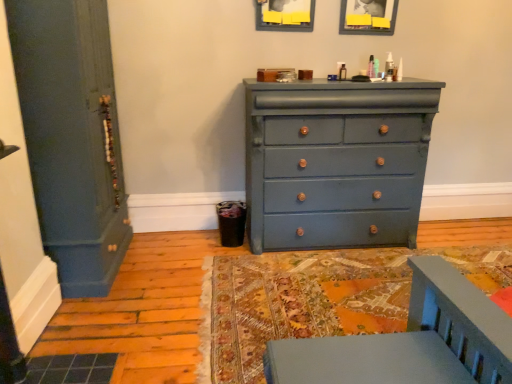
Question: Is matte wooden picture frame at upper center, positioned as the second picture frame in left-to-right order, taller than matte blue door at left?

Choices:
 (A) no
 (B) yes

Answer: (A)

Question: From a real-world perspective, is matte wooden picture frame at upper center, positioned as the 1th picture frame in right-to-left order, beneath matte blue door at left?

Choices:
 (A) yes
 (B) no

Answer: (B)

Question: Does matte wooden picture frame at upper center, positioned as the 1th picture frame in right-to-left order, have a larger size compared to matte blue door at left?

Choices:
 (A) yes
 (B) no

Answer: (B)

Question: Does matte wooden picture frame at upper center, positioned as the second picture frame in left-to-right order, have a lesser height compared to matte blue door at left?

Choices:
 (A) no
 (B) yes

Answer: (B)

Question: Considering the relative sizes of matte wooden picture frame at upper center, positioned as the second picture frame in left-to-right order, and matte blue door at left in the image provided, is matte wooden picture frame at upper center, positioned as the second picture frame in left-to-right order, thinner than matte blue door at left?

Choices:
 (A) yes
 (B) no

Answer: (A)

Question: From a real-world perspective, is matte blue door at left positioned above or below matte wooden picture frame at upper center, positioned as the second picture frame in left-to-right order?

Choices:
 (A) above
 (B) below

Answer: (B)

Question: From the image's perspective, is matte blue door at left above or below matte wooden picture frame at upper center, positioned as the second picture frame in left-to-right order?

Choices:
 (A) below
 (B) above

Answer: (A)

Question: Is matte blue door at left inside the boundaries of matte wooden picture frame at upper center, positioned as the second picture frame in left-to-right order, or outside?

Choices:
 (A) outside
 (B) inside

Answer: (A)

Question: Relative to matte wooden picture frame at upper center, positioned as the second picture frame in left-to-right order, is matte blue door at left in front or behind?

Choices:
 (A) behind
 (B) front

Answer: (B)

Question: Is matte gray picture frame at upper center, positioned as the second picture frame in right-to-left order, taller or shorter than matte blue dresser at center?

Choices:
 (A) short
 (B) tall

Answer: (A)

Question: Considering the positions of matte gray picture frame at upper center, acting as the first picture frame starting from the left, and matte blue dresser at center in the image, is matte gray picture frame at upper center, acting as the first picture frame starting from the left, wider or thinner than matte blue dresser at center?

Choices:
 (A) wide
 (B) thin

Answer: (B)

Question: Considering the relative positions of matte gray picture frame at upper center, positioned as the second picture frame in right-to-left order, and matte blue dresser at center in the image provided, is matte gray picture frame at upper center, positioned as the second picture frame in right-to-left order, to the left or to the right of matte blue dresser at center?

Choices:
 (A) right
 (B) left

Answer: (B)

Question: Considering the positions of point (300, 28) and point (400, 96), is point (300, 28) closer or farther from the camera than point (400, 96)?

Choices:
 (A) closer
 (B) farther

Answer: (B)

Question: Is matte wooden picture frame at upper center, positioned as the second picture frame in left-to-right order, bigger or smaller than matte blue dresser at center?

Choices:
 (A) big
 (B) small

Answer: (B)

Question: Visually, is matte wooden picture frame at upper center, positioned as the 1th picture frame in right-to-left order, positioned to the left or to the right of matte blue dresser at center?

Choices:
 (A) left
 (B) right

Answer: (B)